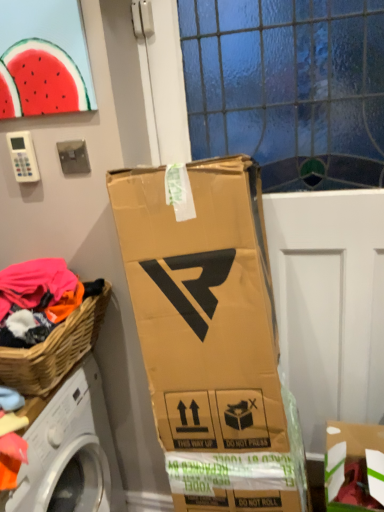
Question: From the image's perspective, would you say watermelon at upper left is positioned over cardboard box at lower right?

Choices:
 (A) yes
 (B) no

Answer: (A)

Question: From a real-world perspective, is watermelon at upper left positioned over cardboard box at lower right based on gravity?

Choices:
 (A) yes
 (B) no

Answer: (A)

Question: Is watermelon at upper left oriented away from cardboard box at lower right?

Choices:
 (A) yes
 (B) no

Answer: (B)

Question: From a real-world perspective, is watermelon at upper left under cardboard box at lower right?

Choices:
 (A) yes
 (B) no

Answer: (B)

Question: Is watermelon at upper left taller than cardboard box at lower right?

Choices:
 (A) yes
 (B) no

Answer: (B)

Question: From the image's perspective, is woven wood picnic basket at lower left above or below cardboard box at lower right?

Choices:
 (A) below
 (B) above

Answer: (B)

Question: Considering their positions, is woven wood picnic basket at lower left located in front of or behind cardboard box at lower right?

Choices:
 (A) behind
 (B) front

Answer: (B)

Question: Would you say woven wood picnic basket at lower left is inside or outside cardboard box at lower right?

Choices:
 (A) outside
 (B) inside

Answer: (A)

Question: Is point (39, 388) positioned closer to the camera than point (380, 501)?

Choices:
 (A) farther
 (B) closer

Answer: (B)

Question: Is cardboard box at lower right wider or thinner than watermelon at upper left?

Choices:
 (A) wide
 (B) thin

Answer: (A)

Question: Is point (350, 444) closer or farther from the camera than point (52, 84)?

Choices:
 (A) farther
 (B) closer

Answer: (A)

Question: In terms of size, does cardboard box at lower right appear bigger or smaller than watermelon at upper left?

Choices:
 (A) small
 (B) big

Answer: (B)

Question: Considering the positions of cardboard box at lower right and watermelon at upper left in the image, is cardboard box at lower right taller or shorter than watermelon at upper left?

Choices:
 (A) short
 (B) tall

Answer: (B)

Question: Is transparent glass door at center inside the boundaries of woven wood picnic basket at lower left, or outside?

Choices:
 (A) outside
 (B) inside

Answer: (A)

Question: Considering the positions of transparent glass door at center and woven wood picnic basket at lower left in the image, is transparent glass door at center bigger or smaller than woven wood picnic basket at lower left?

Choices:
 (A) big
 (B) small

Answer: (A)